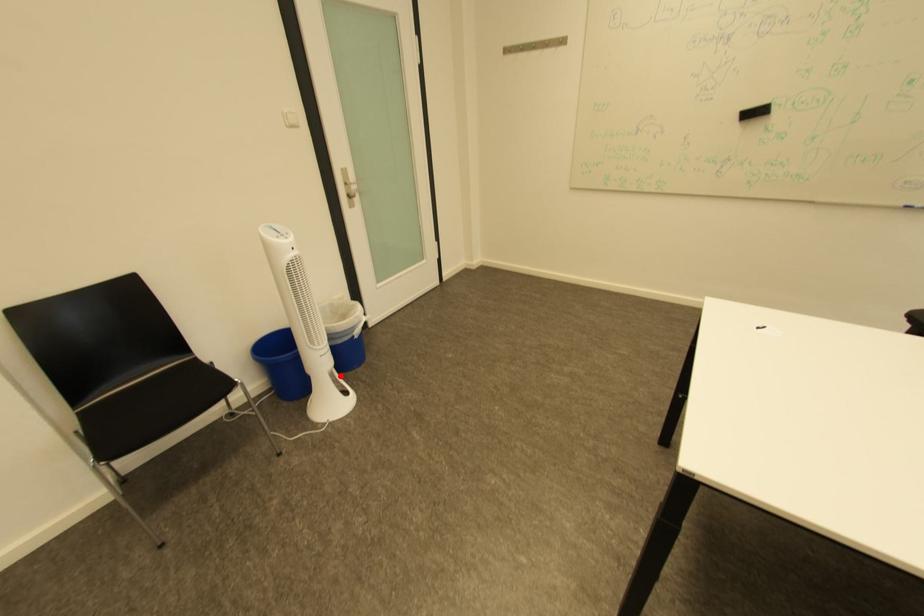
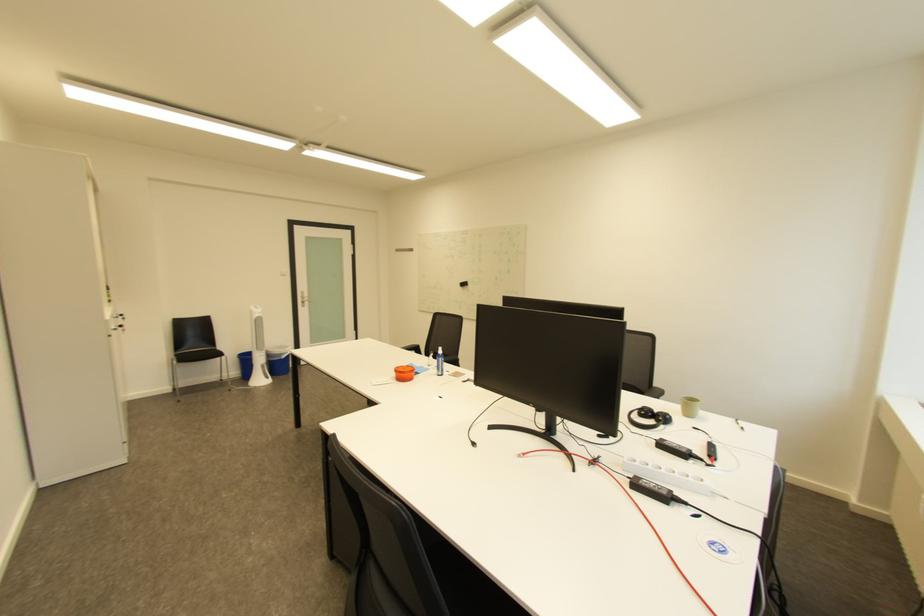
Where in the second image is the point corresponding to the highlighted location from the first image?

(273, 367)